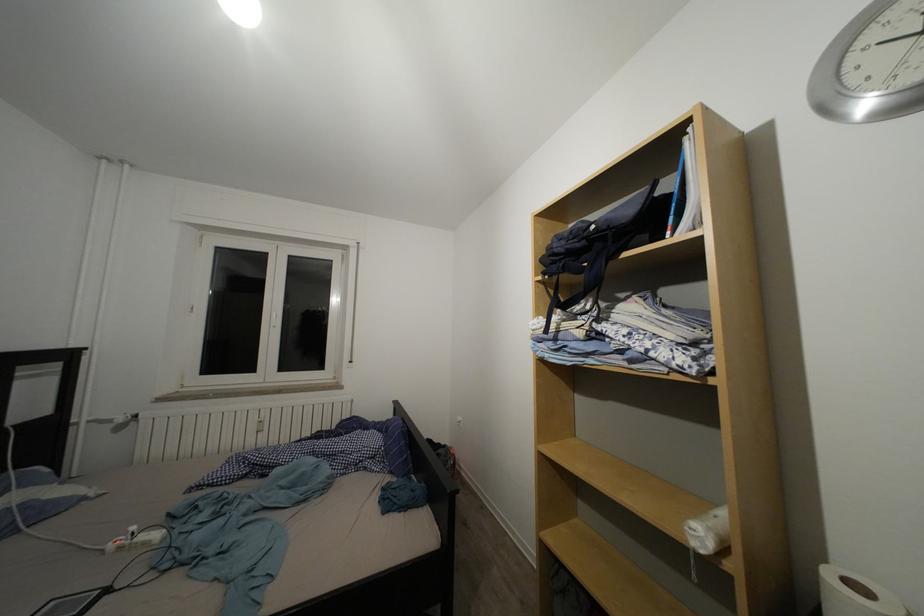
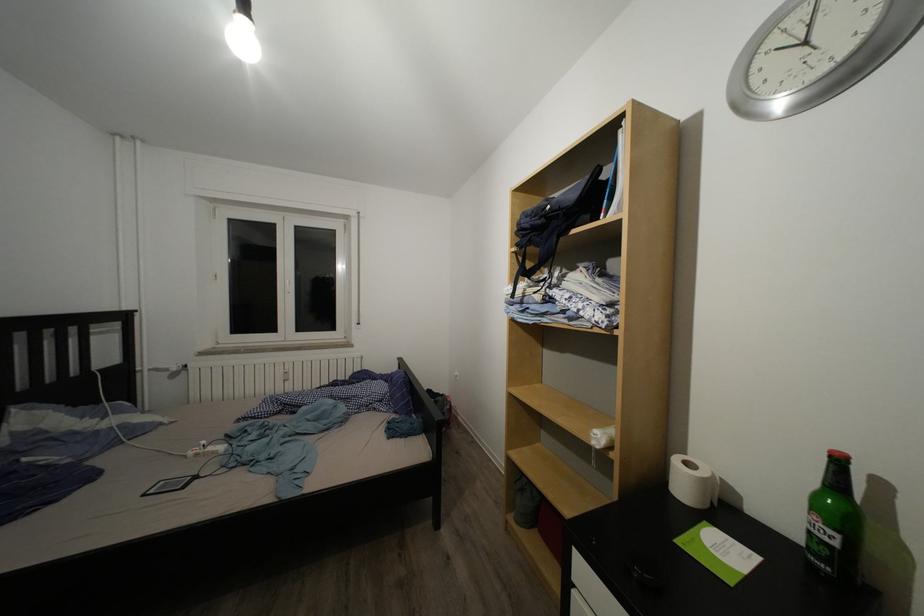
Question: How did the camera likely rotate?

Choices:
 (A) Left
 (B) Right
 (C) Up
 (D) Down

Answer: (D)